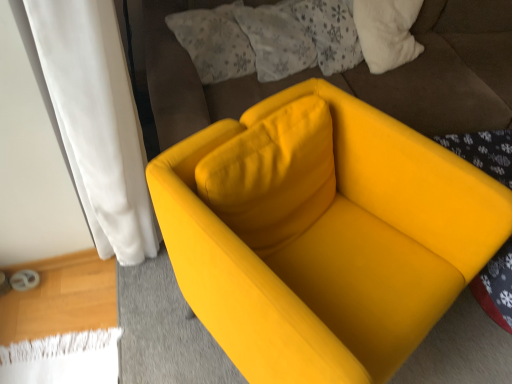
Question: Considering the relative sizes of fluffy white pillow at upper center, marked as the second pillow in a right-to-left arrangement, and matte yellow armchair at center in the image provided, is fluffy white pillow at upper center, marked as the second pillow in a right-to-left arrangement, bigger than matte yellow armchair at center?

Choices:
 (A) yes
 (B) no

Answer: (B)

Question: Is fluffy white pillow at upper center, placed as the 1th pillow when sorted from left to right, at the left side of matte yellow armchair at center?

Choices:
 (A) yes
 (B) no

Answer: (A)

Question: Is fluffy white pillow at upper center, marked as the second pillow in a right-to-left arrangement, located outside matte yellow armchair at center?

Choices:
 (A) yes
 (B) no

Answer: (A)

Question: Considering the relative sizes of fluffy white pillow at upper center, marked as the second pillow in a right-to-left arrangement, and matte yellow armchair at center in the image provided, is fluffy white pillow at upper center, marked as the second pillow in a right-to-left arrangement, taller than matte yellow armchair at center?

Choices:
 (A) yes
 (B) no

Answer: (B)

Question: Is fluffy white pillow at upper center, placed as the 1th pillow when sorted from left to right, positioned far away from matte yellow armchair at center?

Choices:
 (A) no
 (B) yes

Answer: (A)

Question: Considering the relative positions of fluffy white pillow at upper center, placed as the 1th pillow when sorted from left to right, and matte yellow armchair at center in the image provided, is fluffy white pillow at upper center, placed as the 1th pillow when sorted from left to right, to the right of matte yellow armchair at center from the viewer's perspective?

Choices:
 (A) yes
 (B) no

Answer: (B)

Question: Is matte yellow armchair at center far away from fluffy white pillow at upper center, the 1th pillow viewed from the right?

Choices:
 (A) no
 (B) yes

Answer: (A)

Question: Can you confirm if matte yellow armchair at center is wider than fluffy white pillow at upper center, the 1th pillow viewed from the right?

Choices:
 (A) no
 (B) yes

Answer: (B)

Question: Considering the relative positions of matte yellow armchair at center and fluffy white pillow at upper center, the 2th pillow from the left, in the image provided, is matte yellow armchair at center to the left of fluffy white pillow at upper center, the 2th pillow from the left, from the viewer's perspective?

Choices:
 (A) no
 (B) yes

Answer: (A)

Question: Is matte yellow armchair at center surrounding fluffy white pillow at upper center, the 2th pillow from the left?

Choices:
 (A) yes
 (B) no

Answer: (A)

Question: Does matte yellow armchair at center have a greater height compared to fluffy white pillow at upper center, the 1th pillow viewed from the right?

Choices:
 (A) no
 (B) yes

Answer: (B)

Question: Is matte yellow armchair at center thinner than fluffy white pillow at upper center, the 1th pillow viewed from the right?

Choices:
 (A) yes
 (B) no

Answer: (B)

Question: Is the position of fluffy white pillow at upper center, marked as the second pillow in a right-to-left arrangement, more distant than that of fluffy white pillow at upper center, the 2th pillow from the left?

Choices:
 (A) yes
 (B) no

Answer: (B)